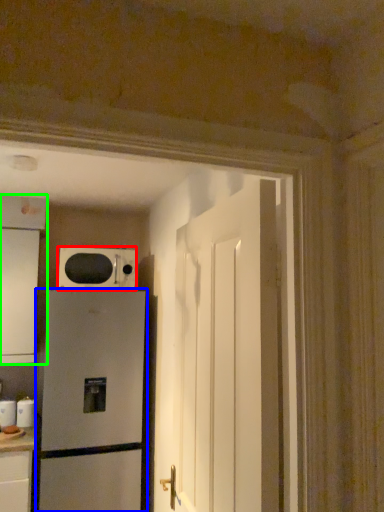
Question: Considering the real-world distances, which object is closest to microwave oven (highlighted by a red box)? refrigerator (highlighted by a blue box) or cabinetry (highlighted by a green box).

Choices:
 (A) refrigerator
 (B) cabinetry

Answer: (B)